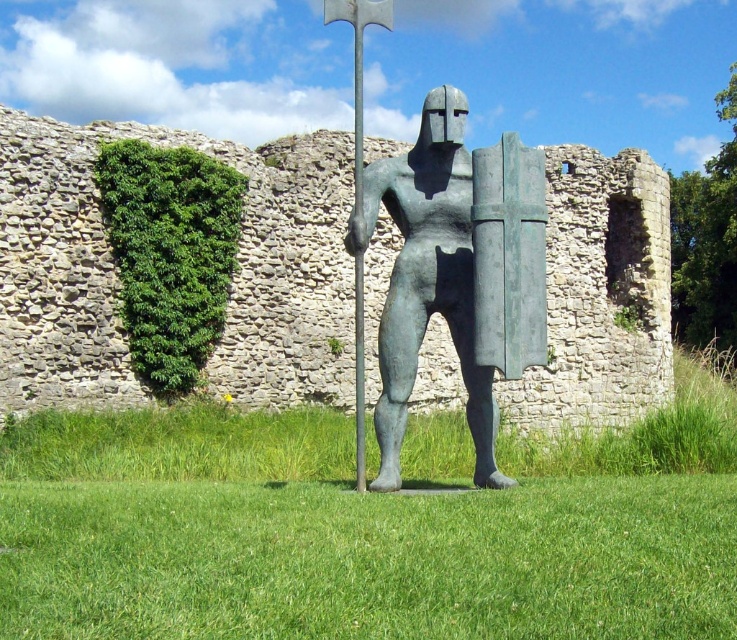
Question: Can you confirm if green grass at center is positioned to the left of bronze statue at center?

Choices:
 (A) no
 (B) yes

Answer: (B)

Question: Does green grass at center appear on the right side of bronze statue at center?

Choices:
 (A) yes
 (B) no

Answer: (B)

Question: Can you confirm if green grass at center is positioned to the left of bronze statue at center?

Choices:
 (A) no
 (B) yes

Answer: (B)

Question: Which object appears farthest from the camera in this image?

Choices:
 (A) bronze statue at center
 (B) green grass at center

Answer: (A)

Question: Which point is closer to the camera?

Choices:
 (A) (471, 604)
 (B) (475, 209)

Answer: (A)